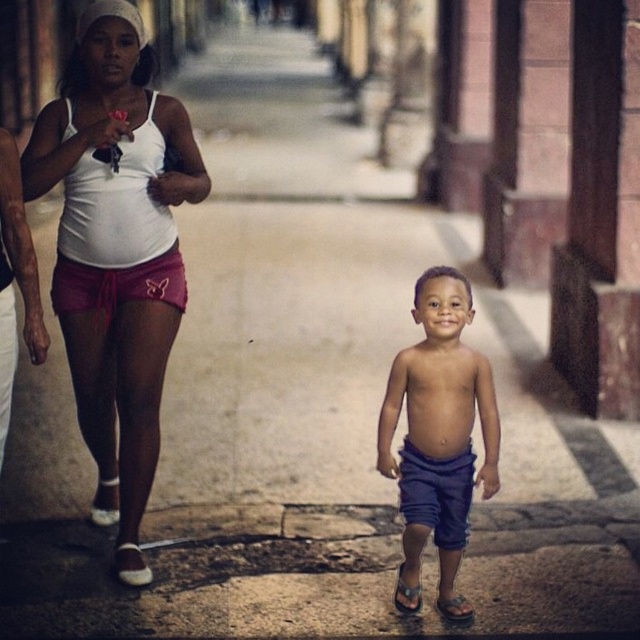
You are standing in the street scene and want to know how far the point at coordinates (145,321) is from you. Can you determine the distance?

The point at coordinates (145,321) is 5.57 meters away from the viewer.

You are a photographer standing 10 feet away from the blue denim shorts at center and smooth skin torso at center. You want to take a photo that includes both objects in the frame. Can you do it without moving your position?

The blue denim shorts at center and smooth skin torso at center are 7.46 feet apart from each other. Since you are standing 10 feet away from them, the distance between the two objects is less than your distance from them. This means they can both fit within your camera frame without needing to move. So yes, you can take the photo as desired.